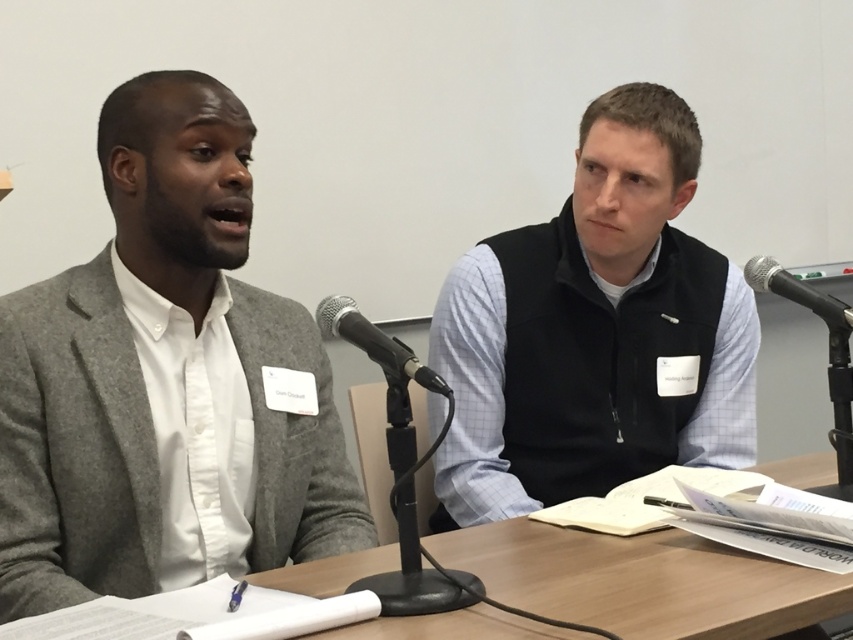
You are organizing a small conference and need to ensure that all participants can comfortably see each other. Given the black vest at center and the wooden table at center, which object is larger and might obstruct the view of someone sitting behind it?

The black vest at center is bigger than the wooden table at center, so it might obstruct the view of someone sitting behind it.

You are a sound technician adjusting the microphone stand for an upcoming panel discussion. The wooden table at center is where the panelists will place their notes. You need to ensure that the black metallic microphone at upper right is positioned so that it is 24 inches away from the table edge. Based on the current setup, is the microphone too close or too far from the table?

The distance of wooden table at center from black metallic microphone at upper right is 23.13 inches. Since the required distance is 24 inches, the microphone is currently too close to the table by approximately 0.87 inches.

Please describe the location of the black vest at center in the image using the coordinate system provided in the Objects Description.

The black vest at center is located at point coordinates of 0.517 on the x axis and 0.699 on the y axis.